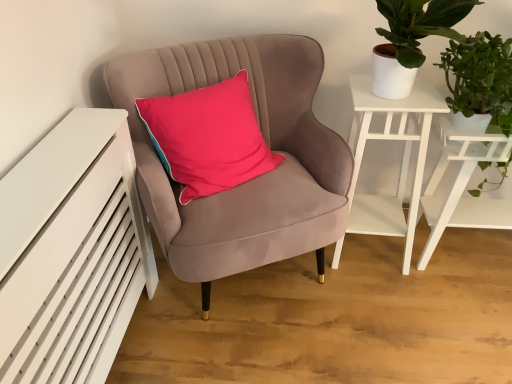
Identify the location of vacant region below white matte table at right (from a real-world perspective). This screenshot has height=384, width=512. (469, 253).